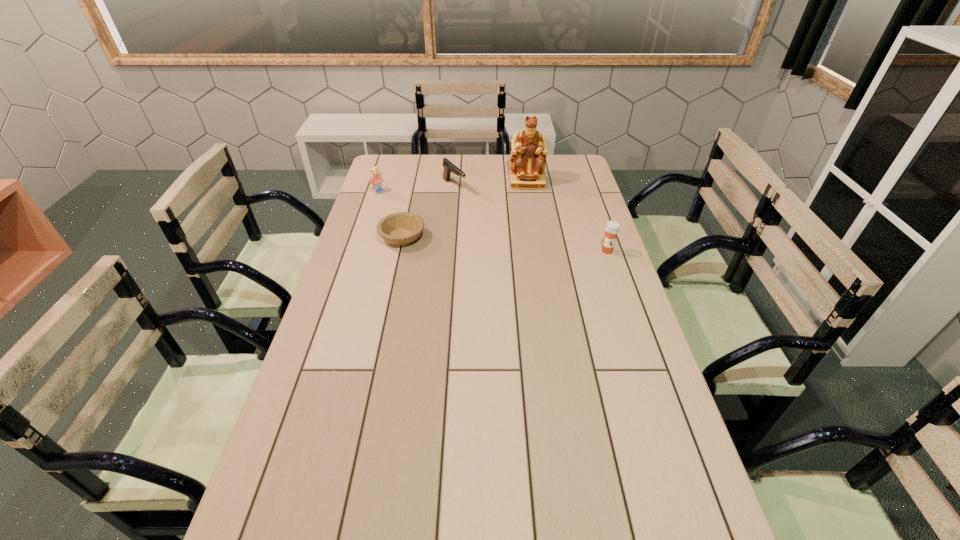
At what (x,y) coordinates should I click in order to perform the action: click on the fourth object from right to left. Please return your answer as a coordinate pair (x, y). The width and height of the screenshot is (960, 540). Looking at the image, I should click on (401, 228).

Find the location of `bowl`. bowl is located at coordinates (401, 228).

This screenshot has height=540, width=960. I want to click on the rightmost object, so click(612, 228).

Locate an element on the screen. pistol is located at coordinates (449, 167).

You are a GUI agent. You are given a task and a screenshot of the screen. Output one action in this format:
    pyautogui.click(x=<x>, y=<y>)
    Task: Click on the leftmost object
    The image size is (960, 540).
    Given the screenshot: What is the action you would take?
    tap(375, 180)

The image size is (960, 540). What are the coordinates of `the tallest object` in the screenshot? It's located at (529, 147).

Locate an element on the screen. figurine is located at coordinates click(529, 147).

You are a GUI agent. You are given a task and a screenshot of the screen. Output one action in this format:
    pyautogui.click(x=<x>, y=<y>)
    Task: Click on the free space located 0.140m on the front of the bowl
    The width and height of the screenshot is (960, 540).
    Given the screenshot: What is the action you would take?
    [x=394, y=279]

Locate an element on the screen. This screenshot has width=960, height=540. free space located 0.390m on the label side of the medicine is located at coordinates (638, 343).

The height and width of the screenshot is (540, 960). What are the coordinates of `blank area located at the muzzle of the third object from right to left` in the screenshot? It's located at (509, 237).